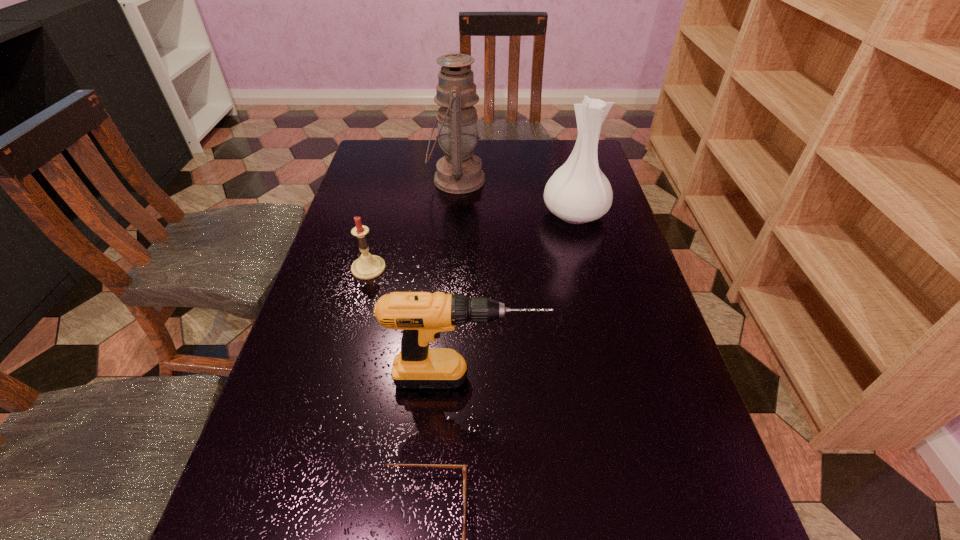
Where is `vacant space located on the back of the candle`? Image resolution: width=960 pixels, height=540 pixels. vacant space located on the back of the candle is located at coordinates (393, 180).

I want to click on object at the far edge, so click(459, 171).

Locate an element on the screen. The width and height of the screenshot is (960, 540). object that is at the left edge is located at coordinates (368, 266).

Where is `object positioned at the right edge`? object positioned at the right edge is located at coordinates (578, 192).

The image size is (960, 540). I want to click on vacant space at the far edge of the desktop, so click(431, 167).

The width and height of the screenshot is (960, 540). I want to click on free space at the left edge of the desktop, so click(290, 433).

The width and height of the screenshot is (960, 540). Identify the location of free space at the right edge. (629, 256).

This screenshot has width=960, height=540. I want to click on free space at the far left corner of the desktop, so click(x=376, y=153).

Where is `free space between the vase and the second nearest object`? free space between the vase and the second nearest object is located at coordinates (520, 296).

Find the location of a particular element. The height and width of the screenshot is (540, 960). empty space between the third shortest object and the second tallest object is located at coordinates (520, 296).